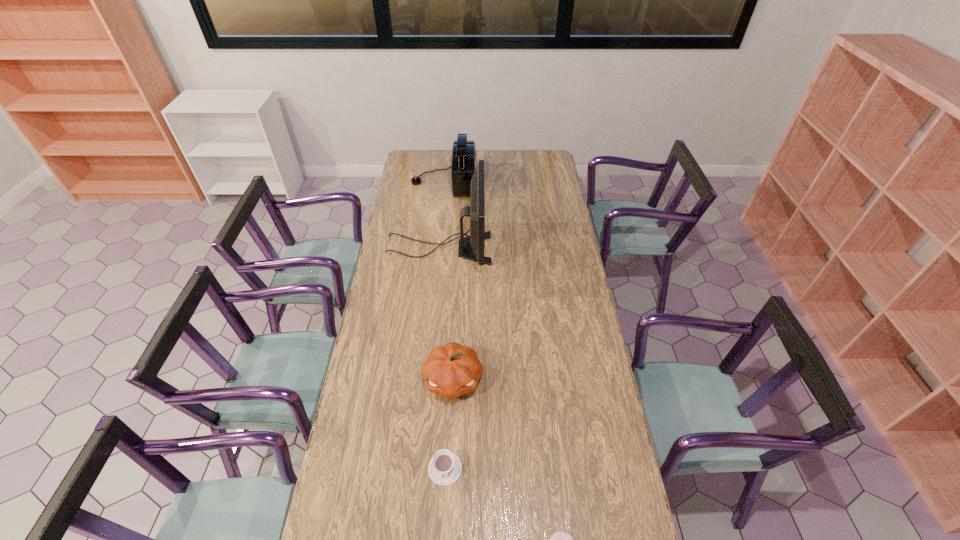
Find the location of `blank space located 0.090m on the front face of the third shortest object`. blank space located 0.090m on the front face of the third shortest object is located at coordinates (450, 431).

This screenshot has height=540, width=960. In order to click on free spot located 0.140m on the handle side of the teacup in this screenshot , I will do `click(442, 537)`.

Locate an element on the screen. Image resolution: width=960 pixels, height=540 pixels. object present at the far edge is located at coordinates (464, 152).

At what (x,y) coordinates should I click in order to perform the action: click on computer monitor positioned at the left edge. Please return your answer as a coordinate pair (x, y). Image resolution: width=960 pixels, height=540 pixels. Looking at the image, I should click on (475, 242).

The height and width of the screenshot is (540, 960). In order to click on radio receiver positioned at the left edge in this screenshot , I will do `click(464, 152)`.

Find the location of a particular element. The width and height of the screenshot is (960, 540). object that is at the far left corner is located at coordinates (464, 152).

Identify the location of free location at the left edge of the desktop. This screenshot has width=960, height=540. (416, 263).

At what (x,y) coordinates should I click in order to perform the action: click on free region at the right edge of the desktop. Please return your answer as a coordinate pair (x, y). Looking at the image, I should click on (576, 339).

Find the location of a particular element. The image size is (960, 540). free space at the far left corner of the desktop is located at coordinates (417, 153).

The image size is (960, 540). In order to click on empty space that is in between the farthest object and the fourth nearest object in this screenshot , I will do `click(442, 215)`.